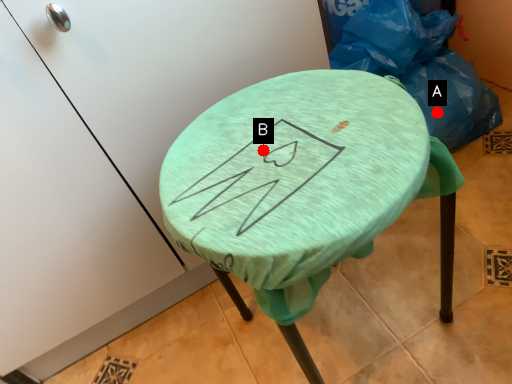
Question: Two points are circled on the image, labeled by A and B beside each circle. Which point appears closest to the camera in this image?

Choices:
 (A) A is closer
 (B) B is closer

Answer: (B)